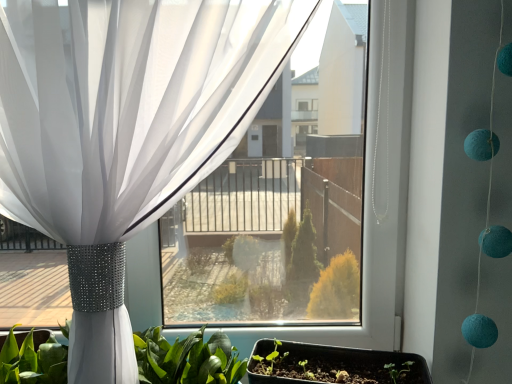
Question: Based on their positions, is matte black tray at lower center located to the left or right of white sheer curtain at upper left?

Choices:
 (A) right
 (B) left

Answer: (A)

Question: Considering the positions of matte black tray at lower center and white sheer curtain at upper left in the image, is matte black tray at lower center taller or shorter than white sheer curtain at upper left?

Choices:
 (A) tall
 (B) short

Answer: (B)

Question: Based on their relative distances, which object is farther from the green leafy plant at lower center?

Choices:
 (A) matte black tray at lower center
 (B) white sheer curtain at upper left

Answer: (B)

Question: Based on their relative distances, which object is farther from the green leafy plant at lower center?

Choices:
 (A) white sheer curtain at upper left
 (B) matte black tray at lower center

Answer: (A)